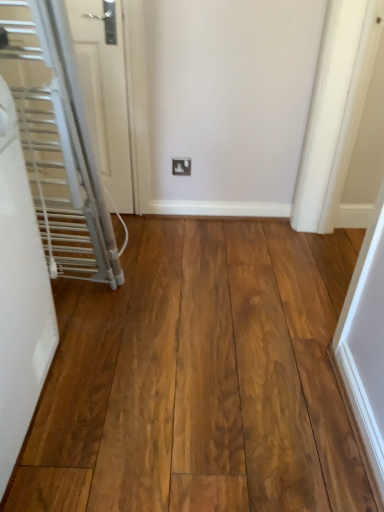
Question: In terms of size, does white glossy door at left, arranged as the second door when viewed from the front, appear bigger or smaller than white plastic outlet at center?

Choices:
 (A) small
 (B) big

Answer: (B)

Question: From a real-world perspective, is white glossy door at left, placed as the 1th door when sorted from back to front, positioned above or below white plastic outlet at center?

Choices:
 (A) below
 (B) above

Answer: (B)

Question: Which of these objects is positioned farthest from the white matte radiator at left, which appears as the 1th door when viewed from the front?

Choices:
 (A) white glossy door at left, placed as the 1th door when sorted from back to front
 (B) white plastic outlet at center
 (C) natural wood flooring at center

Answer: (B)

Question: Based on their relative distances, which object is farther from the white matte radiator at left, which appears as the 1th door when viewed from the front?

Choices:
 (A) white glossy door at left, placed as the 1th door when sorted from back to front
 (B) natural wood flooring at center
 (C) white plastic outlet at center

Answer: (C)